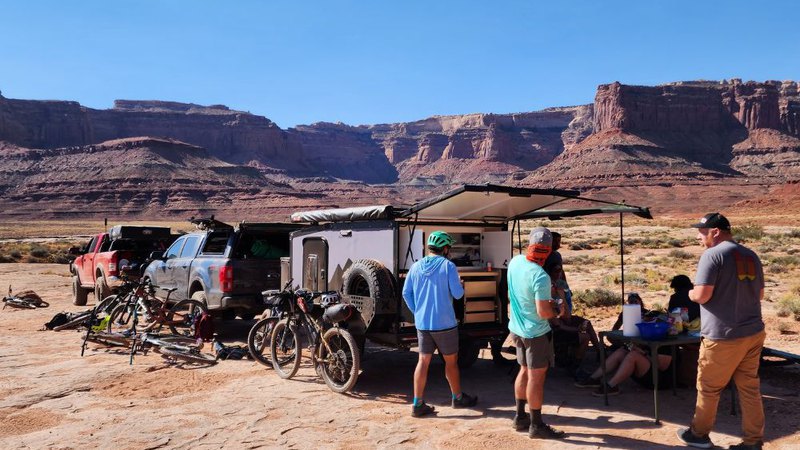
Where is `white kitchen roll`? Image resolution: width=800 pixels, height=450 pixels. white kitchen roll is located at coordinates (626, 312).